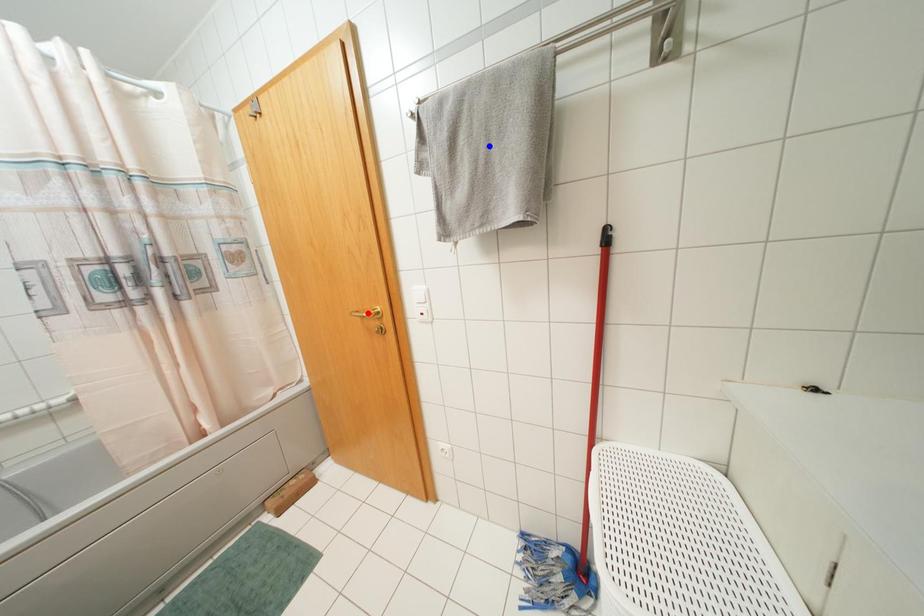
Question: In the image, two points are highlighted. Which point is nearer to the camera? Reply with the corresponding letter.

Choices:
 (A) blue point
 (B) red point

Answer: (A)